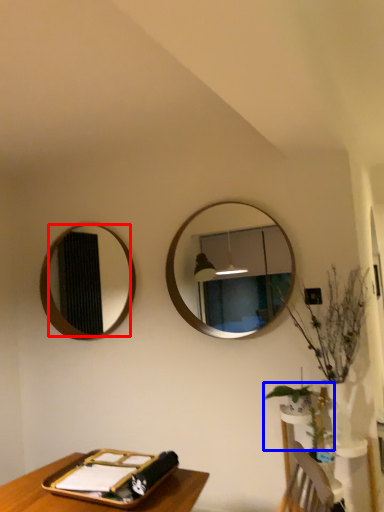
Question: Which object is closer to the camera taking this photo, mirror (highlighted by a red box) or plant (highlighted by a blue box)?

Choices:
 (A) mirror
 (B) plant

Answer: (B)